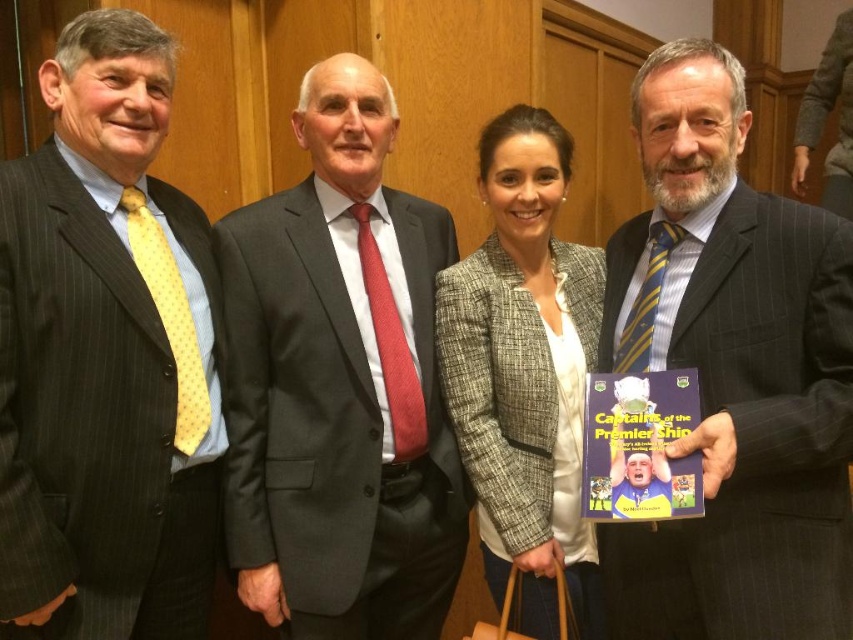
Between dark gray suit at center and plaid blazer at center, which one is positioned lower?

Positioned lower is plaid blazer at center.

Is point (447, 499) farther from camera compared to point (480, 182)?

No, it is not.

Which is in front, point (393, 460) or point (567, 564)?

Point (393, 460)

Locate an element on the screen. The height and width of the screenshot is (640, 853). dark gray suit at center is located at coordinates (340, 385).

Is the position of striped wool suit at center more distant than that of dark gray suit at center?

That is False.

Between striped wool suit at center and dark gray suit at center, which one is positioned lower?

dark gray suit at center is below.

Who is more distant from viewer, (703, 577) or (395, 545)?

The point (395, 545) is behind.

This screenshot has height=640, width=853. Identify the location of striped wool suit at center. (732, 372).

Can you confirm if matte black suit at left is bigger than dark gray suit at center?

Actually, matte black suit at left might be smaller than dark gray suit at center.

Measure the distance between point (172, 196) and camera.

A distance of 5.47 feet exists between point (172, 196) and camera.

Where is `matte black suit at left`? This screenshot has height=640, width=853. matte black suit at left is located at coordinates (105, 356).